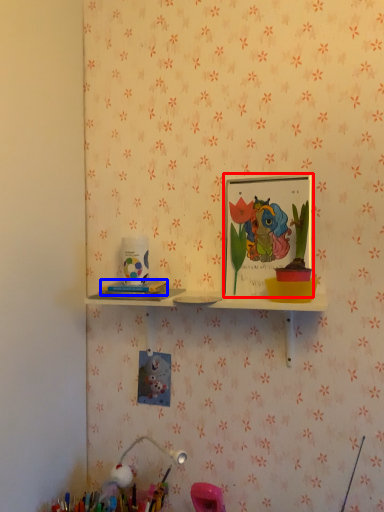
Question: Which object is closer to the camera taking this photo, picture frame (highlighted by a red box) or stationery (highlighted by a blue box)?

Choices:
 (A) picture frame
 (B) stationery

Answer: (A)